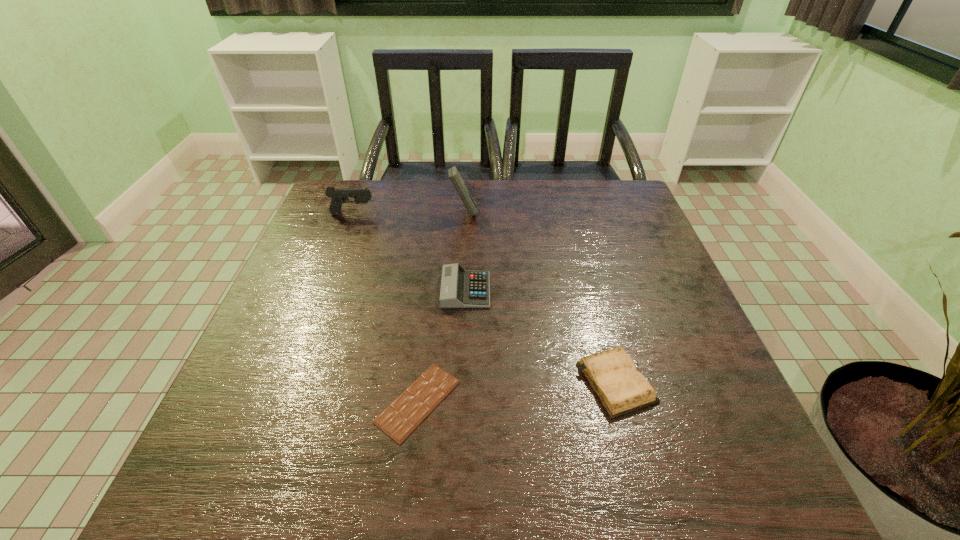
Find the location of a particular element. vacant region at the left edge of the desktop is located at coordinates (315, 291).

Locate an element on the screen. The image size is (960, 540). vacant space at the right edge of the desktop is located at coordinates (671, 448).

Locate an element on the screen. This screenshot has width=960, height=540. vacant region at the far left corner of the desktop is located at coordinates (366, 182).

Locate an element on the screen. This screenshot has width=960, height=540. vacant space at the far right corner of the desktop is located at coordinates (610, 206).

The width and height of the screenshot is (960, 540). I want to click on vacant space at the near right corner of the desktop, so click(x=692, y=476).

Where is `vacant region between the pistol and the shortest object`? The image size is (960, 540). vacant region between the pistol and the shortest object is located at coordinates (385, 308).

Find the location of a particular element. This screenshot has width=960, height=540. free space that is in between the chocolate bar and the pistol is located at coordinates (385, 308).

You are a GUI agent. You are given a task and a screenshot of the screen. Output one action in this format:
    pyautogui.click(x=<x>, y=<y>)
    Task: Click on the vacant region between the chocolate bar and the leftmost object
    This screenshot has height=540, width=960.
    Given the screenshot: What is the action you would take?
    pyautogui.click(x=385, y=308)

What are the coordinates of `vacant area between the third shortest object and the rightmost object` in the screenshot? It's located at (540, 336).

Locate an element on the screen. The height and width of the screenshot is (540, 960). free space between the pistol and the third shortest object is located at coordinates (409, 252).